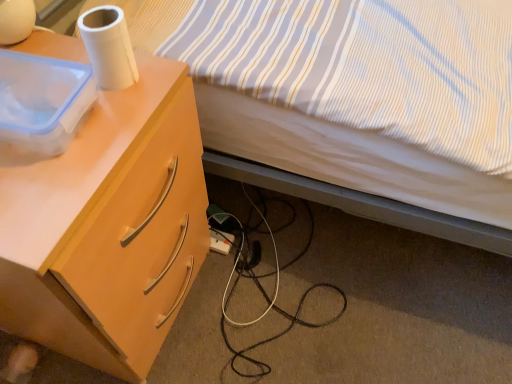
Locate an element on the screen. This screenshot has height=384, width=512. space that is in front of white matte paper towel at upper left is located at coordinates (91, 148).